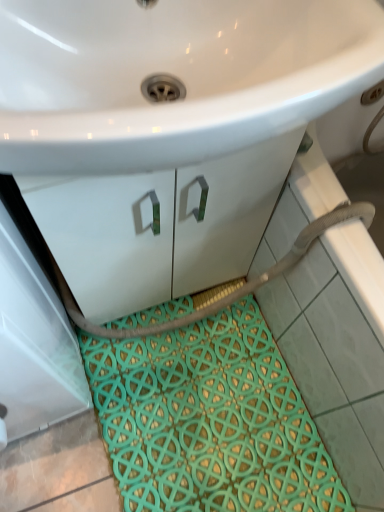
Question: Considering the positions of teal woven bath mat at lower center and white glossy sink at upper center in the image, is teal woven bath mat at lower center bigger or smaller than white glossy sink at upper center?

Choices:
 (A) small
 (B) big

Answer: (A)

Question: Looking at their shapes, would you say teal woven bath mat at lower center is wider or thinner than white glossy sink at upper center?

Choices:
 (A) thin
 (B) wide

Answer: (B)

Question: Based on their positions, is teal woven bath mat at lower center located to the left or right of white glossy sink at upper center?

Choices:
 (A) right
 (B) left

Answer: (A)

Question: Is white glossy sink at upper center inside the boundaries of teal woven bath mat at lower center, or outside?

Choices:
 (A) inside
 (B) outside

Answer: (B)

Question: From their relative heights in the image, would you say white glossy sink at upper center is taller or shorter than teal woven bath mat at lower center?

Choices:
 (A) short
 (B) tall

Answer: (B)

Question: Based on their sizes in the image, would you say white glossy sink at upper center is bigger or smaller than teal woven bath mat at lower center?

Choices:
 (A) big
 (B) small

Answer: (A)

Question: Does point (72, 155) appear closer or farther from the camera than point (215, 370)?

Choices:
 (A) closer
 (B) farther

Answer: (A)